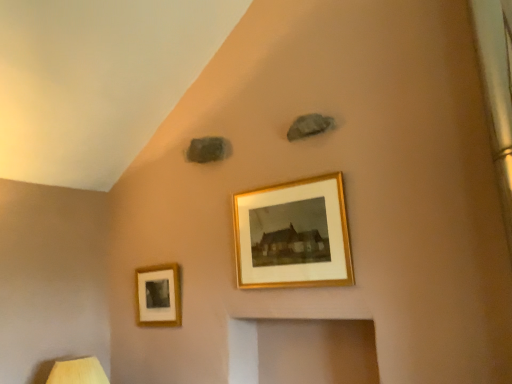
I want to click on matte gold picture frame at lower left, the second picture frame from the top, so point(158,295).

In order to face gold-framed picture at center, the 2th picture frame positioned from the back, should I rotate leftwards or rightwards?

Turn right approximately 4.161 degrees to face it.

What do you see at coordinates (293, 235) in the screenshot? The image size is (512, 384). I see `gold-framed picture at center, which is the 1th picture frame in right-to-left order` at bounding box center [293, 235].

Measure the distance between wooden table lamp at lower left and camera.

wooden table lamp at lower left is 2.02 meters away from camera.

Locate an element on the screen. The width and height of the screenshot is (512, 384). matte gold picture frame at lower left, the second picture frame from the top is located at coordinates (158, 295).

Which object is positioned more to the right, matte gold picture frame at lower left, positioned as the second picture frame in right-to-left order, or gold-framed picture at center, the 2th picture frame viewed from the left?

gold-framed picture at center, the 2th picture frame viewed from the left, is more to the right.

Between matte gold picture frame at lower left, the first picture frame viewed from the left, and gold-framed picture at center, positioned as the 2th picture frame in bottom-to-top order, which one has larger width?

gold-framed picture at center, positioned as the 2th picture frame in bottom-to-top order, is wider.

Locate an element on the screen. picture frame that appears behind the gold-framed picture at center, positioned as the 2th picture frame in bottom-to-top order is located at coordinates (158, 295).

Is matte gold picture frame at lower left, the 2th picture frame when ordered from front to back, positioned beyond the bounds of gold-framed picture at center, the 1th picture frame positioned from the front?

Yes, matte gold picture frame at lower left, the 2th picture frame when ordered from front to back, is outside of gold-framed picture at center, the 1th picture frame positioned from the front.

Is matte gold picture frame at lower left, which is the 1th picture frame in bottom-to-top order, not close to wooden table lamp at lower left?

No.

Is matte gold picture frame at lower left, the second picture frame from the top, oriented away from wooden table lamp at lower left?

No, wooden table lamp at lower left is not at the back of matte gold picture frame at lower left, the second picture frame from the top.

Which point is more forward, (176, 282) or (59, 380)?

Positioned in front is point (59, 380).

Looking at the image, does gold-framed picture at center, the 2th picture frame viewed from the left, seem bigger or smaller compared to wooden table lamp at lower left?

Considering their sizes, gold-framed picture at center, the 2th picture frame viewed from the left, takes up less space than wooden table lamp at lower left.

Can wooden table lamp at lower left be found inside gold-framed picture at center, positioned as the 2th picture frame in bottom-to-top order?

No, gold-framed picture at center, positioned as the 2th picture frame in bottom-to-top order, does not contain wooden table lamp at lower left.

You are a GUI agent. You are given a task and a screenshot of the screen. Output one action in this format:
    pyautogui.click(x=<x>, y=<y>)
    Task: Click on the picture frame in front of the wooden table lamp at lower left
    This screenshot has height=384, width=512.
    Given the screenshot: What is the action you would take?
    pyautogui.click(x=293, y=235)

Considering the relative sizes of gold-framed picture at center, the 2th picture frame positioned from the back, and matte gold picture frame at lower left, the first picture frame positioned from the back, in the image provided, is gold-framed picture at center, the 2th picture frame positioned from the back, wider than matte gold picture frame at lower left, the first picture frame positioned from the back,?

Yes, gold-framed picture at center, the 2th picture frame positioned from the back, is wider than matte gold picture frame at lower left, the first picture frame positioned from the back.

Can you confirm if gold-framed picture at center, the 1th picture frame positioned from the front, is positioned to the left of matte gold picture frame at lower left, which is the 1th picture frame in bottom-to-top order?

No.

Is gold-framed picture at center, the 1th picture frame when ordered from top to bottom, not within matte gold picture frame at lower left, which is the 1th picture frame in bottom-to-top order?

gold-framed picture at center, the 1th picture frame when ordered from top to bottom, is positioned outside matte gold picture frame at lower left, which is the 1th picture frame in bottom-to-top order.

Is gold-framed picture at center, the 1th picture frame positioned from the front, in front of or behind matte gold picture frame at lower left, the first picture frame positioned from the back, in the image?

Clearly, gold-framed picture at center, the 1th picture frame positioned from the front, is in front of matte gold picture frame at lower left, the first picture frame positioned from the back.

Is matte gold picture frame at lower left, the 2th picture frame when ordered from front to back, surrounded by wooden table lamp at lower left?

No, matte gold picture frame at lower left, the 2th picture frame when ordered from front to back, is not surrounded by wooden table lamp at lower left.

Is wooden table lamp at lower left with matte gold picture frame at lower left, the first picture frame positioned from the back?

There is a gap between wooden table lamp at lower left and matte gold picture frame at lower left, the first picture frame positioned from the back.

From a real-world perspective, is wooden table lamp at lower left positioned under matte gold picture frame at lower left, the 2th picture frame when ordered from front to back, based on gravity?

Yes, from a real-world perspective, wooden table lamp at lower left is beneath matte gold picture frame at lower left, the 2th picture frame when ordered from front to back.

From the image's perspective, which object appears higher, wooden table lamp at lower left or gold-framed picture at center, the 2th picture frame positioned from the back?

From the image's view, gold-framed picture at center, the 2th picture frame positioned from the back, is above.

Can you confirm if wooden table lamp at lower left is thinner than gold-framed picture at center, the 1th picture frame positioned from the front?

No, wooden table lamp at lower left is not thinner than gold-framed picture at center, the 1th picture frame positioned from the front.

Based on the photo, is wooden table lamp at lower left further to the viewer compared to gold-framed picture at center, the 1th picture frame positioned from the front?

That is True.

Would you say gold-framed picture at center, the 2th picture frame viewed from the left, is part of wooden table lamp at lower left's contents?

No.

Locate an element on the screen. Image resolution: width=512 pixels, height=384 pixels. picture frame above the matte gold picture frame at lower left, which is the 1th picture frame in bottom-to-top order (from a real-world perspective) is located at coordinates (293, 235).

Locate an element on the screen. The width and height of the screenshot is (512, 384). picture frame behind the wooden table lamp at lower left is located at coordinates (158, 295).

Looking at the image, which one is located closer to matte gold picture frame at lower left, the first picture frame positioned from the back, gold-framed picture at center, which is the 1th picture frame in right-to-left order, or wooden table lamp at lower left?

wooden table lamp at lower left is closer to matte gold picture frame at lower left, the first picture frame positioned from the back.

When comparing their distances from wooden table lamp at lower left, does matte gold picture frame at lower left, the second picture frame from the top, or gold-framed picture at center, the 2th picture frame positioned from the back, seem further?

Among the two, gold-framed picture at center, the 2th picture frame positioned from the back, is located further to wooden table lamp at lower left.

Looking at the image, which one is located further to gold-framed picture at center, the 1th picture frame when ordered from top to bottom, matte gold picture frame at lower left, the first picture frame viewed from the left, or wooden table lamp at lower left?

Based on the image, wooden table lamp at lower left appears to be further to gold-framed picture at center, the 1th picture frame when ordered from top to bottom.

When comparing their distances from gold-framed picture at center, positioned as the 2th picture frame in bottom-to-top order, does wooden table lamp at lower left or matte gold picture frame at lower left, the second picture frame from the top, seem further?

wooden table lamp at lower left is positioned further to the anchor gold-framed picture at center, positioned as the 2th picture frame in bottom-to-top order.

Estimate the real-world distances between objects in this image. Which object is closer to matte gold picture frame at lower left, positioned as the second picture frame in right-to-left order, wooden table lamp at lower left or gold-framed picture at center, the 2th picture frame positioned from the back?

The object closer to matte gold picture frame at lower left, positioned as the second picture frame in right-to-left order, is wooden table lamp at lower left.

From the image, which object appears to be farther from wooden table lamp at lower left, gold-framed picture at center, which is the 1th picture frame in right-to-left order, or matte gold picture frame at lower left, the first picture frame viewed from the left?

gold-framed picture at center, which is the 1th picture frame in right-to-left order.

Where is `picture frame between wooden table lamp at lower left and gold-framed picture at center, the 1th picture frame when ordered from top to bottom`? The width and height of the screenshot is (512, 384). picture frame between wooden table lamp at lower left and gold-framed picture at center, the 1th picture frame when ordered from top to bottom is located at coordinates (158, 295).